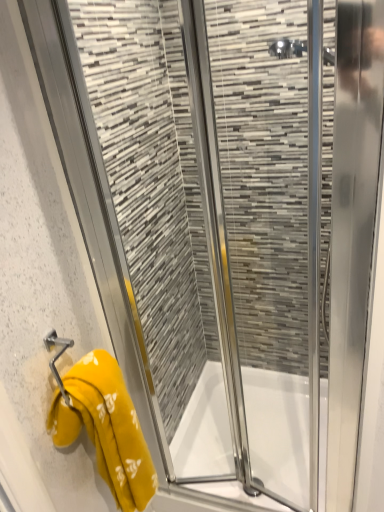
What do you see at coordinates (106, 428) in the screenshot? This screenshot has height=512, width=384. I see `yellow fabric towel at left` at bounding box center [106, 428].

This screenshot has width=384, height=512. In order to click on yellow fabric towel at left in this screenshot , I will do `click(106, 428)`.

Locate an element on the screen. white glossy bath at center is located at coordinates (279, 431).

Image resolution: width=384 pixels, height=512 pixels. What do you see at coordinates (279, 431) in the screenshot? I see `white glossy bath at center` at bounding box center [279, 431].

Looking at this image, what is the approximate width of white glossy bath at center?

27.72 inches.

Identify the location of yellow fabric towel at left. click(x=106, y=428).

Is yellow fabric towel at left to the left of white glossy bath at center from the viewer's perspective?

Correct, you'll find yellow fabric towel at left to the left of white glossy bath at center.

Does yellow fabric towel at left lie in front of white glossy bath at center?

Yes, it is.

Does point (115, 418) come farther from viewer compared to point (210, 389)?

No, (115, 418) is closer to viewer.

From the image's perspective, is yellow fabric towel at left located above white glossy bath at center?

Yes, from the image's perspective, yellow fabric towel at left is above white glossy bath at center.

From a real-world perspective, between yellow fabric towel at left and white glossy bath at center, who is vertically higher?

In real-world perspective, yellow fabric towel at left is above.

Which of these two, yellow fabric towel at left or white glossy bath at center, is thinner?

Thinner between the two is yellow fabric towel at left.

Who is taller, yellow fabric towel at left or white glossy bath at center?

yellow fabric towel at left is taller.

Considering the relative sizes of yellow fabric towel at left and white glossy bath at center in the image provided, is yellow fabric towel at left bigger than white glossy bath at center?

Incorrect, yellow fabric towel at left is not larger than white glossy bath at center.

Is white glossy bath at center inside yellow fabric towel at left?

No, white glossy bath at center is not surrounded by yellow fabric towel at left.

Consider the image. Is the surface of yellow fabric towel at left in direct contact with white glossy bath at center?

No, yellow fabric towel at left is not with white glossy bath at center.

Could you tell me if yellow fabric towel at left is facing white glossy bath at center?

No.

How much distance is there between yellow fabric towel at left and white glossy bath at center?

The distance of yellow fabric towel at left from white glossy bath at center is 26.63 inches.

Locate an element on the screen. This screenshot has width=384, height=512. towel lying above the white glossy bath at center (from the image's perspective) is located at coordinates (106, 428).

Between white glossy bath at center and yellow fabric towel at left, which one appears on the right side from the viewer's perspective?

white glossy bath at center is more to the right.

Considering the positions of objects white glossy bath at center and yellow fabric towel at left in the image provided, who is behind, white glossy bath at center or yellow fabric towel at left?

white glossy bath at center.

Which is behind, point (191, 420) or point (118, 489)?

Point (191, 420)

From the image's perspective, is white glossy bath at center above or below yellow fabric towel at left?

Based on their image positions, white glossy bath at center is located beneath yellow fabric towel at left.

From a real-world perspective, is white glossy bath at center located beneath yellow fabric towel at left?

Yes, from a real-world perspective, white glossy bath at center is beneath yellow fabric towel at left.

Does white glossy bath at center have a lesser width compared to yellow fabric towel at left?

In fact, white glossy bath at center might be wider than yellow fabric towel at left.

Between white glossy bath at center and yellow fabric towel at left, which one has more height?

With more height is yellow fabric towel at left.

Based on their sizes in the image, would you say white glossy bath at center is bigger or smaller than yellow fabric towel at left?

white glossy bath at center is bigger than yellow fabric towel at left.

Choose the correct answer: Is white glossy bath at center inside yellow fabric towel at left or outside it?

white glossy bath at center lies outside yellow fabric towel at left.

Is white glossy bath at center in contact with yellow fabric towel at left?

white glossy bath at center and yellow fabric towel at left are clearly separated.

Could you tell me if white glossy bath at center is facing yellow fabric towel at left?

No, white glossy bath at center is not aimed at yellow fabric towel at left.

How different are the orientations of white glossy bath at center and yellow fabric towel at left in degrees?

There is a 90-degree angle between the facing directions of white glossy bath at center and yellow fabric towel at left.

Locate an element on the screen. This screenshot has height=512, width=384. towel in front of the white glossy bath at center is located at coordinates (106, 428).

The height and width of the screenshot is (512, 384). I want to click on bath on the right of yellow fabric towel at left, so click(x=279, y=431).

Where is `towel that appears in front of the white glossy bath at center`? The height and width of the screenshot is (512, 384). towel that appears in front of the white glossy bath at center is located at coordinates (106, 428).